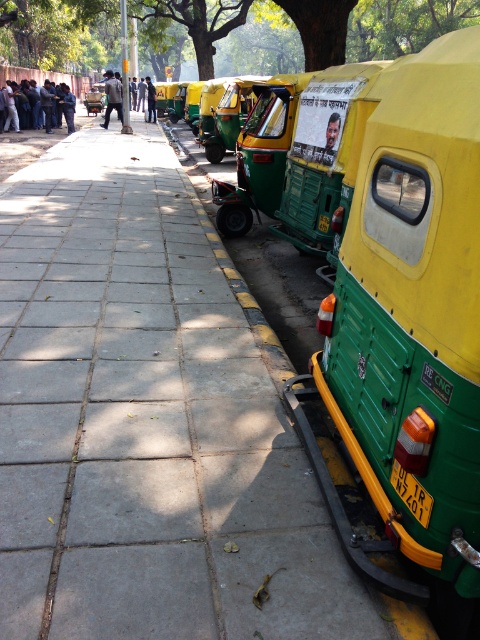
Does green leafy tree at upper center appear on the right side of dark blue shirt at center?

Yes, green leafy tree at upper center is to the right of dark blue shirt at center.

Can you confirm if green leafy tree at upper center is positioned to the left of dark blue shirt at center?

No, green leafy tree at upper center is not to the left of dark blue shirt at center.

Who is more distant from viewer, (360, 4) or (149, 96)?

The point (149, 96) is more distant.

You are a GUI agent. You are given a task and a screenshot of the screen. Output one action in this format:
    pyautogui.click(x=<x>, y=<y>)
    Task: Click on the green leafy tree at upper center
    The width and height of the screenshot is (480, 640).
    Given the screenshot: What is the action you would take?
    pyautogui.click(x=309, y=24)

Who is more distant from viewer, (72, 324) or (156, 28)?

The point (156, 28) is behind.

Between paved concrete sidewalk at center and green leafy tree at upper center, which one has less height?

Standing shorter between the two is paved concrete sidewalk at center.

The width and height of the screenshot is (480, 640). In order to click on paved concrete sidewalk at center in this screenshot , I will do `click(145, 422)`.

The image size is (480, 640). I want to click on paved concrete sidewalk at center, so click(145, 422).

Which of these two, green leafy tree at upper center or dark blue jacket at upper left, stands taller?

green leafy tree at upper center is taller.

From the picture: Does green leafy tree at upper center have a lesser height compared to dark blue jacket at upper left?

Incorrect, green leafy tree at upper center's height does not fall short of dark blue jacket at upper left's.

Is point (203, 20) closer to viewer compared to point (116, 88)?

No, (203, 20) is behind (116, 88).

Where is `green leafy tree at upper center`? This screenshot has height=640, width=480. green leafy tree at upper center is located at coordinates [x=309, y=24].